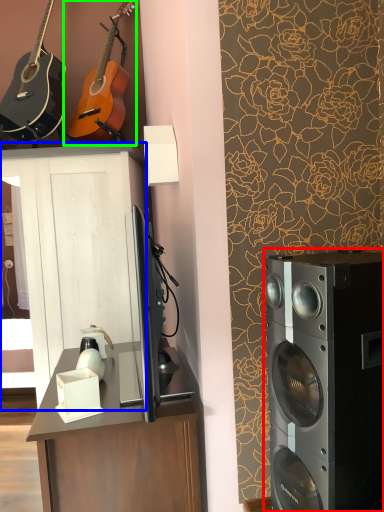
Question: Which object is the farthest from home appliance (highlighted by a red box)? Choose among these: cabinetry (highlighted by a blue box) or guitar (highlighted by a green box).

Choices:
 (A) cabinetry
 (B) guitar

Answer: (B)